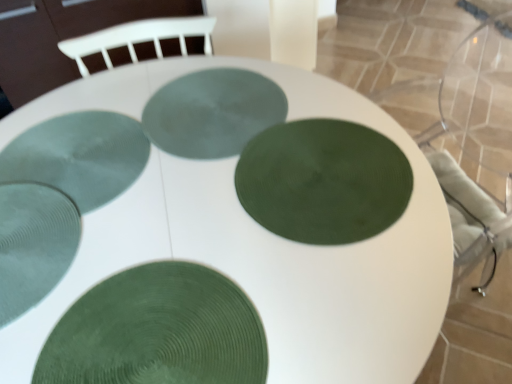
Locate an element on the screen. This screenshot has height=384, width=512. free space that is to the left of green textured glass plate at center, which is the 1th glass plate in back-to-front order is located at coordinates (84, 134).